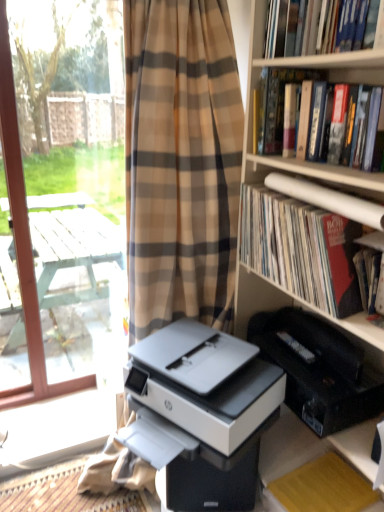
What is the approximate width of yellow paper at lower right?

The width of yellow paper at lower right is 12.47 inches.

You are a GUI agent. You are given a task and a screenshot of the screen. Output one action in this format:
    pyautogui.click(x=<x>, y=<y>)
    Task: Click on the matte paper book at right, which is the third book in top-to-bottom order
    The image size is (384, 512).
    Given the screenshot: What is the action you would take?
    pyautogui.click(x=301, y=249)

You are a GUI agent. You are given a task and a screenshot of the screen. Output one action in this format:
    pyautogui.click(x=<x>, y=<y>)
    Task: Click on the white plastic printer at center, the 1th printer from the right
    
    Given the screenshot: What is the action you would take?
    pyautogui.click(x=319, y=370)

How different are the orientations of matte paper book at right, which is the first book in bottom-to-top order, and white wood screen door at left in degrees?

90.9 degrees.

Find the location of a particular element. the 1st book positioned above the white wood screen door at left (from a real-world perspective) is located at coordinates (301, 249).

Is matte paper book at right, which is the first book in bottom-to-top order, not near white wood screen door at left?

Yes.

From a real-world perspective, relative to white wood screen door at left, is matte paper book at right, which is the first book in bottom-to-top order, vertically above or below?

matte paper book at right, which is the first book in bottom-to-top order, is situated higher than white wood screen door at left in the real world.

Between hardcover book at upper right, positioned as the first book in top-to-bottom order, and white plastic printer at center, the 1th printer from the right, which one appears on the right side from the viewer's perspective?

Positioned to the right is hardcover book at upper right, positioned as the first book in top-to-bottom order.

The image size is (384, 512). Find the location of `book that is the 3rd object located above the white plastic printer at center, the 1th printer from the right (from the image's perspective)`. book that is the 3rd object located above the white plastic printer at center, the 1th printer from the right (from the image's perspective) is located at coordinates (346, 25).

Is hardcover book at upper right, positioned as the first book in top-to-bottom order, next to white plastic printer at center, the 1th printer from the right, and touching it?

hardcover book at upper right, positioned as the first book in top-to-bottom order, and white plastic printer at center, the 1th printer from the right, are clearly separated.

From a real-world perspective, between hardcover book at upper right, arranged as the 3th book when ordered from the bottom, and white plastic printer at center, the 2th printer positioned from the left, who is vertically lower?

white plastic printer at center, the 2th printer positioned from the left.

Relative to yellow paper at lower right, is white plastic printer at center, the 2th printer positioned from the left, in front or behind?

Clearly, white plastic printer at center, the 2th printer positioned from the left, is in front of yellow paper at lower right.

Between point (368, 399) and point (347, 471), which one is positioned in front?

Positioned in front is point (368, 399).

Is white plastic printer at center, the 1th printer from the right, not inside yellow paper at lower right?

Absolutely, white plastic printer at center, the 1th printer from the right, is external to yellow paper at lower right.

Is white plastic printer at center, the 1th printer from the right, positioned with its back to yellow paper at lower right?

No.

Is hardcover book at upper right, arranged as the 3th book when ordered from the bottom, aimed at yellow paper at lower right?

No, hardcover book at upper right, arranged as the 3th book when ordered from the bottom, is not facing towards yellow paper at lower right.

Looking at the image, does hardcover book at upper right, positioned as the first book in top-to-bottom order, seem bigger or smaller compared to yellow paper at lower right?

Clearly, hardcover book at upper right, positioned as the first book in top-to-bottom order, is larger in size than yellow paper at lower right.

Is hardcover book at upper right, positioned as the first book in top-to-bottom order, closer to the viewer compared to yellow paper at lower right?

Yes.

From the image's perspective, which is below, hardcover book at upper right, positioned as the first book in top-to-bottom order, or yellow paper at lower right?

yellow paper at lower right, from the image's perspective.

Is hardcover book at upper right, marked as the second book in a top-to-bottom arrangement, oriented towards matte paper book at right, which is the first book in bottom-to-top order?

No, hardcover book at upper right, marked as the second book in a top-to-bottom arrangement, is not oriented towards matte paper book at right, which is the first book in bottom-to-top order.

From a real-world perspective, is hardcover book at upper right, positioned as the second book in bottom-to-top order, physically located above or below matte paper book at right, which is the first book in bottom-to-top order?

From a real-world perspective, hardcover book at upper right, positioned as the second book in bottom-to-top order, is physically above matte paper book at right, which is the first book in bottom-to-top order.

Between point (366, 138) and point (286, 210), which one is positioned in front?

The point (366, 138) is closer.

How many degrees apart are the facing directions of hardcover book at upper right, positioned as the second book in bottom-to-top order, and matte paper book at right, which is the third book in top-to-bottom order?

The angle between the facing direction of hardcover book at upper right, positioned as the second book in bottom-to-top order, and the facing direction of matte paper book at right, which is the third book in top-to-bottom order, is 0.000916 degrees.

Would you consider white plastic printer at center, which is counted as the first printer, starting from the left, to be distant from white plastic printer at center, the 2th printer positioned from the left?

No, white plastic printer at center, which is counted as the first printer, starting from the left, is not far away from white plastic printer at center, the 2th printer positioned from the left.

From the picture: How far apart are white plastic printer at center, which appears as the second printer when viewed from the right, and white plastic printer at center, the 2th printer positioned from the left?

A distance of 12.01 inches exists between white plastic printer at center, which appears as the second printer when viewed from the right, and white plastic printer at center, the 2th printer positioned from the left.

Between white plastic printer at center, which appears as the second printer when viewed from the right, and white plastic printer at center, the 1th printer from the right, which one appears on the left side from the viewer's perspective?

Positioned to the left is white plastic printer at center, which appears as the second printer when viewed from the right.

Which of these two, hardcover book at upper right, marked as the second book in a top-to-bottom arrangement, or white plastic printer at center, which is counted as the first printer, starting from the left, is thinner?

Thinner between the two is hardcover book at upper right, marked as the second book in a top-to-bottom arrangement.

Which is more to the right, hardcover book at upper right, marked as the second book in a top-to-bottom arrangement, or white plastic printer at center, which is counted as the first printer, starting from the left?

hardcover book at upper right, marked as the second book in a top-to-bottom arrangement, is more to the right.

Does point (299, 100) come behind point (196, 467)?

Yes, it is.

Would you say hardcover book at upper right, marked as the second book in a top-to-bottom arrangement, is a long distance from white plastic printer at center, which appears as the second printer when viewed from the right?

They are positioned close to each other.

Identify the location of the 1st book counting from the right side of the white wood screen door at left. Image resolution: width=384 pixels, height=512 pixels. (301, 249).

From the image's perspective, which printer is the 1st one below the hardcover book at upper right, arranged as the 3th book when ordered from the bottom? Please provide its 2D coordinates.

[(319, 370)]

Looking at the image, which one is located closer to yellow paper at lower right, hardcover book at upper right, positioned as the second book in bottom-to-top order, or matte paper book at right, which is the third book in top-to-bottom order?

matte paper book at right, which is the third book in top-to-bottom order.

Considering their positions, is hardcover book at upper right, arranged as the 3th book when ordered from the bottom, positioned further to matte paper book at right, which is the first book in bottom-to-top order, than white plastic printer at center, the 1th printer from the right?

hardcover book at upper right, arranged as the 3th book when ordered from the bottom.

Which object lies further to the anchor point white plastic printer at center, the 2th printer positioned from the left, hardcover book at upper right, arranged as the 3th book when ordered from the bottom, or hardcover book at upper right, positioned as the second book in bottom-to-top order?

hardcover book at upper right, arranged as the 3th book when ordered from the bottom, lies further to white plastic printer at center, the 2th printer positioned from the left, than the other object.

Which object lies nearer to the anchor point yellow paper at lower right, hardcover book at upper right, arranged as the 3th book when ordered from the bottom, or white wood screen door at left?

Among the two, hardcover book at upper right, arranged as the 3th book when ordered from the bottom, is located nearer to yellow paper at lower right.

Based on the photo, from the image, which object appears to be nearer to yellow paper at lower right, matte paper book at right, which is the first book in bottom-to-top order, or hardcover book at upper right, marked as the second book in a top-to-bottom arrangement?

Among the two, matte paper book at right, which is the first book in bottom-to-top order, is located nearer to yellow paper at lower right.

Consider the image. Based on their spatial positions, is matte paper book at right, which is the third book in top-to-bottom order, or yellow paper at lower right further from white wood screen door at left?

yellow paper at lower right is positioned further to the anchor white wood screen door at left.

Looking at the image, which one is located further to white plastic printer at center, which is counted as the first printer, starting from the left, white wood screen door at left or hardcover book at upper right, marked as the second book in a top-to-bottom arrangement?

white wood screen door at left is positioned further to the anchor white plastic printer at center, which is counted as the first printer, starting from the left.

Considering their positions, is white plastic printer at center, the 1th printer from the right, positioned further to matte paper book at right, which is the third book in top-to-bottom order, than yellow paper at lower right?

Among the two, yellow paper at lower right is located further to matte paper book at right, which is the third book in top-to-bottom order.

At what (x,y) coordinates should I click in order to perform the action: click on book between hardcover book at upper right, positioned as the second book in bottom-to-top order, and yellow paper at lower right in the up-down direction. Please return your answer as a coordinate pair (x, y). The width and height of the screenshot is (384, 512). Looking at the image, I should click on 301,249.

At what (x,y) coordinates should I click in order to perform the action: click on screen door between hardcover book at upper right, positioned as the first book in top-to-bottom order, and white plastic printer at center, which is counted as the first printer, starting from the left, in the vertical direction. Please return your answer as a coordinate pair (x, y). Looking at the image, I should click on click(58, 232).

Where is `screen door between hardcover book at upper right, positioned as the second book in bottom-to-top order, and yellow paper at lower right, in the vertical direction`? The height and width of the screenshot is (512, 384). screen door between hardcover book at upper right, positioned as the second book in bottom-to-top order, and yellow paper at lower right, in the vertical direction is located at coordinates (58, 232).

I want to click on printer between hardcover book at upper right, arranged as the 3th book when ordered from the bottom, and white plastic printer at center, which is counted as the first printer, starting from the left, in the vertical direction, so click(319, 370).